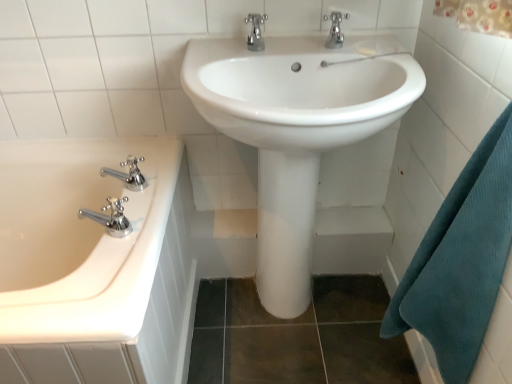
Question: Is white glossy sink at center oriented away from teal waffle towel at right?

Choices:
 (A) yes
 (B) no

Answer: (B)

Question: From the image's perspective, does white glossy sink at center appear higher than teal waffle towel at right?

Choices:
 (A) no
 (B) yes

Answer: (B)

Question: Does white glossy sink at center touch teal waffle towel at right?

Choices:
 (A) no
 (B) yes

Answer: (A)

Question: From a real-world perspective, does white glossy sink at center stand above teal waffle towel at right?

Choices:
 (A) no
 (B) yes

Answer: (A)

Question: Is white glossy sink at center bigger than teal waffle towel at right?

Choices:
 (A) no
 (B) yes

Answer: (B)

Question: Could teal waffle towel at right be considered to be inside white glossy sink at center?

Choices:
 (A) no
 (B) yes

Answer: (A)

Question: Is white glossy bathtub at left surrounding white glossy sink at center?

Choices:
 (A) yes
 (B) no

Answer: (B)

Question: Considering the relative positions of white glossy bathtub at left and white glossy sink at center in the image provided, is white glossy bathtub at left in front of white glossy sink at center?

Choices:
 (A) yes
 (B) no

Answer: (A)

Question: Does white glossy bathtub at left have a lesser height compared to white glossy sink at center?

Choices:
 (A) no
 (B) yes

Answer: (B)

Question: Does white glossy bathtub at left have a lesser width compared to white glossy sink at center?

Choices:
 (A) yes
 (B) no

Answer: (B)

Question: From a real-world perspective, is white glossy bathtub at left on white glossy sink at center?

Choices:
 (A) yes
 (B) no

Answer: (B)

Question: From the image's perspective, is white glossy bathtub at left under white glossy sink at center?

Choices:
 (A) yes
 (B) no

Answer: (A)

Question: Does white glossy sink at center have a larger size compared to chrome metallic faucet at upper center, arranged as the 2th tap when viewed from the top?

Choices:
 (A) no
 (B) yes

Answer: (B)